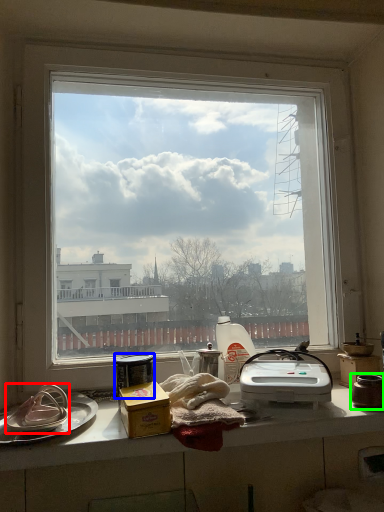
Question: Estimate the real-world distances between objects in this image. Which object is closer to appliance (highlighted by a red box), appliance (highlighted by a blue box) or appliance (highlighted by a green box)?

Choices:
 (A) appliance
 (B) appliance

Answer: (A)